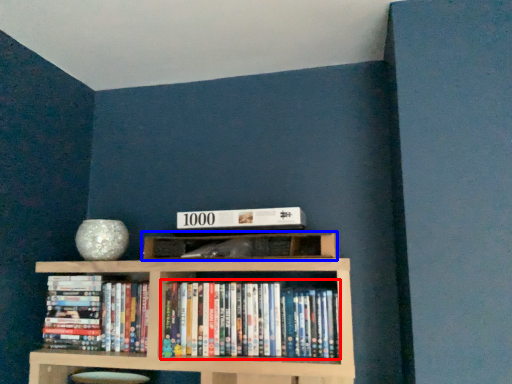
Question: Which object appears farthest to the camera in this image, book (highlighted by a red box) or shelf (highlighted by a blue box)?

Choices:
 (A) book
 (B) shelf

Answer: (A)